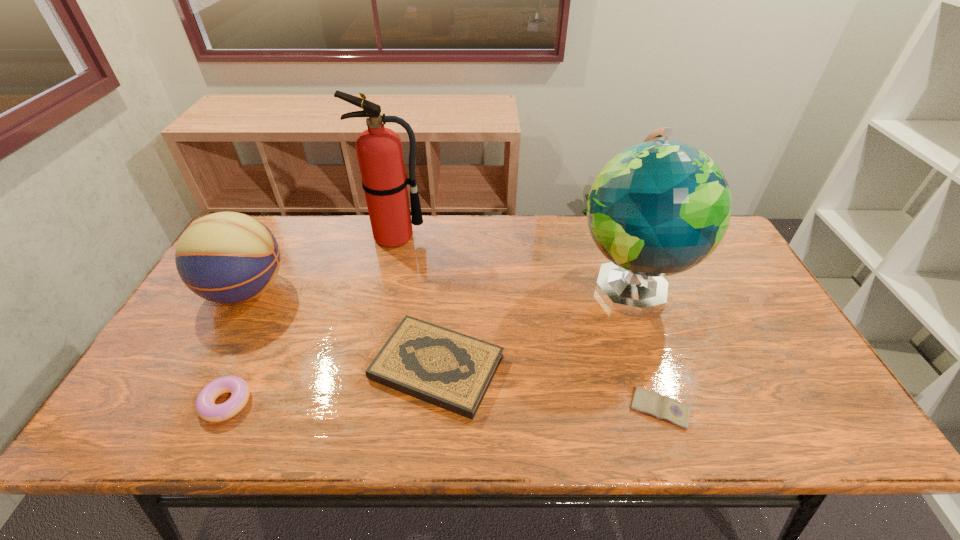
Where is `fire extinguisher`? This screenshot has height=540, width=960. fire extinguisher is located at coordinates (379, 150).

You are a GUI agent. You are given a task and a screenshot of the screen. Output one action in this format:
    pyautogui.click(x=<x>, y=<y>)
    Task: Click on the globe
    The width and height of the screenshot is (960, 540).
    Given the screenshot: What is the action you would take?
    pyautogui.click(x=659, y=208)

Find the location of a particular element. The image size is (960, 540). basketball is located at coordinates (226, 257).

Locate an element on the screen. This screenshot has height=540, width=960. doughnut is located at coordinates (205, 406).

You are a GUI agent. You are given a task and a screenshot of the screen. Output one action in this format:
    pyautogui.click(x=<x>, y=<y>)
    Task: Click on the hardback book
    
    Given the screenshot: What is the action you would take?
    pyautogui.click(x=451, y=370)

At what (x,y) coordinates should I click in order to perform the action: click on the shortest object. Please return your answer as a coordinate pair (x, y). This screenshot has width=960, height=540. Looking at the image, I should click on (652, 403).

Find the location of `blank area located 0.270m at the nozzle of the fire extinguisher`. blank area located 0.270m at the nozzle of the fire extinguisher is located at coordinates (378, 312).

The width and height of the screenshot is (960, 540). What are the coordinates of `vacant space located on the front surface of the globe` in the screenshot? It's located at (656, 362).

The height and width of the screenshot is (540, 960). I want to click on free region located 0.080m on the patterned surface of the fourth shortest object, so click(x=318, y=291).

This screenshot has height=540, width=960. I want to click on vacant space positioned 0.210m on the right of the doughnut, so click(x=342, y=403).